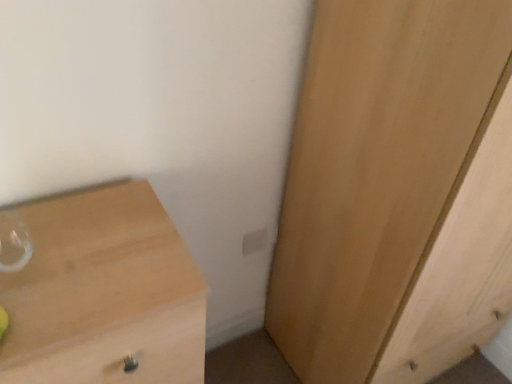
Question: Is light wood cupboard at right not inside white plastic electric outlet at center?

Choices:
 (A) yes
 (B) no

Answer: (A)

Question: Considering the relative positions of light wood cupboard at right and white plastic electric outlet at center in the image provided, is light wood cupboard at right to the left of white plastic electric outlet at center from the viewer's perspective?

Choices:
 (A) yes
 (B) no

Answer: (B)

Question: Is light wood cupboard at right wider than white plastic electric outlet at center?

Choices:
 (A) yes
 (B) no

Answer: (A)

Question: Does light wood cupboard at right have a lesser height compared to white plastic electric outlet at center?

Choices:
 (A) yes
 (B) no

Answer: (B)

Question: From the image's perspective, would you say light wood cupboard at right is shown under white plastic electric outlet at center?

Choices:
 (A) no
 (B) yes

Answer: (A)

Question: Considering the positions of light wood cupboard at right and light wood chest of drawers at lower left in the image, is light wood cupboard at right taller or shorter than light wood chest of drawers at lower left?

Choices:
 (A) short
 (B) tall

Answer: (B)

Question: In the image, is light wood cupboard at right on the left side or the right side of light wood chest of drawers at lower left?

Choices:
 (A) right
 (B) left

Answer: (A)

Question: Is light wood cupboard at right situated inside light wood chest of drawers at lower left or outside?

Choices:
 (A) outside
 (B) inside

Answer: (A)

Question: Looking at their shapes, would you say light wood cupboard at right is wider or thinner than light wood chest of drawers at lower left?

Choices:
 (A) wide
 (B) thin

Answer: (A)

Question: Considering the positions of light wood chest of drawers at lower left and white plastic electric outlet at center in the image, is light wood chest of drawers at lower left wider or thinner than white plastic electric outlet at center?

Choices:
 (A) thin
 (B) wide

Answer: (B)

Question: Is point (135, 347) positioned closer to the camera than point (245, 238)?

Choices:
 (A) closer
 (B) farther

Answer: (A)

Question: From the image's perspective, is light wood chest of drawers at lower left above or below white plastic electric outlet at center?

Choices:
 (A) above
 (B) below

Answer: (B)

Question: In the image, is light wood chest of drawers at lower left on the left side or the right side of white plastic electric outlet at center?

Choices:
 (A) right
 (B) left

Answer: (B)

Question: Do you think white plastic electric outlet at center is within light wood chest of drawers at lower left, or outside of it?

Choices:
 (A) outside
 (B) inside

Answer: (A)

Question: From a real-world perspective, relative to light wood chest of drawers at lower left, is white plastic electric outlet at center vertically above or below?

Choices:
 (A) above
 (B) below

Answer: (A)